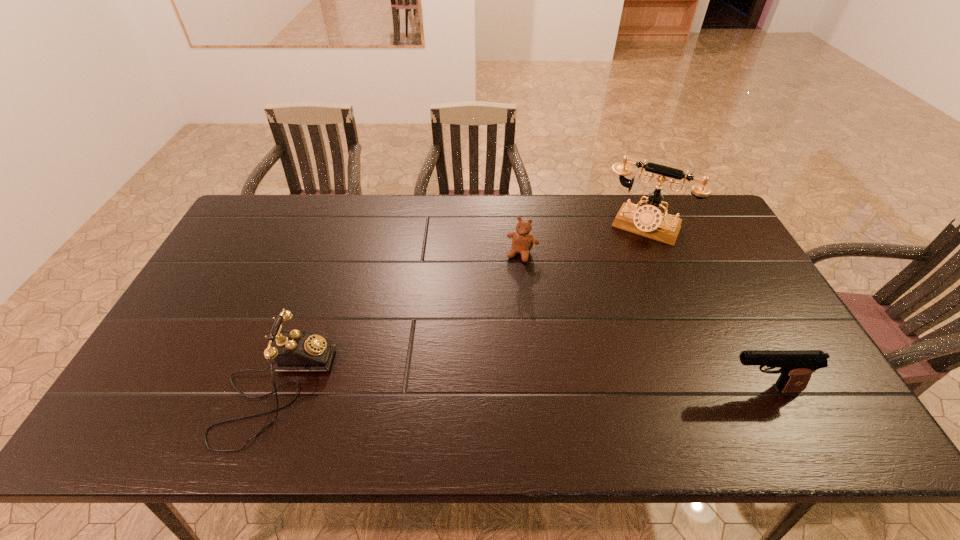
Where is `vacant space located 0.150m on the face of the teddy bear`? The height and width of the screenshot is (540, 960). vacant space located 0.150m on the face of the teddy bear is located at coordinates (501, 296).

Where is `vacant space located 0.260m on the face of the teddy bear`? vacant space located 0.260m on the face of the teddy bear is located at coordinates (488, 325).

Where is `vacant space located 0.260m on the face of the teddy bear`? The image size is (960, 540). vacant space located 0.260m on the face of the teddy bear is located at coordinates (488, 325).

Where is `vacant space located 0.350m on the dial of the taller telephone`? vacant space located 0.350m on the dial of the taller telephone is located at coordinates (595, 315).

I want to click on free region located 0.140m on the dial of the taller telephone, so click(x=618, y=269).

Where is `vacant space positioned 0.070m on the dial of the taller telephone`? Image resolution: width=960 pixels, height=540 pixels. vacant space positioned 0.070m on the dial of the taller telephone is located at coordinates (625, 256).

This screenshot has height=540, width=960. I want to click on object at the far edge, so click(648, 220).

At what (x,y) coordinates should I click in order to perform the action: click on telephone that is at the near edge. Please return your answer as a coordinate pair (x, y). The width and height of the screenshot is (960, 540). Looking at the image, I should click on (293, 351).

Where is `pistol located at the near edge`? The height and width of the screenshot is (540, 960). pistol located at the near edge is located at coordinates (796, 367).

The image size is (960, 540). I want to click on pistol that is at the right edge, so click(796, 367).